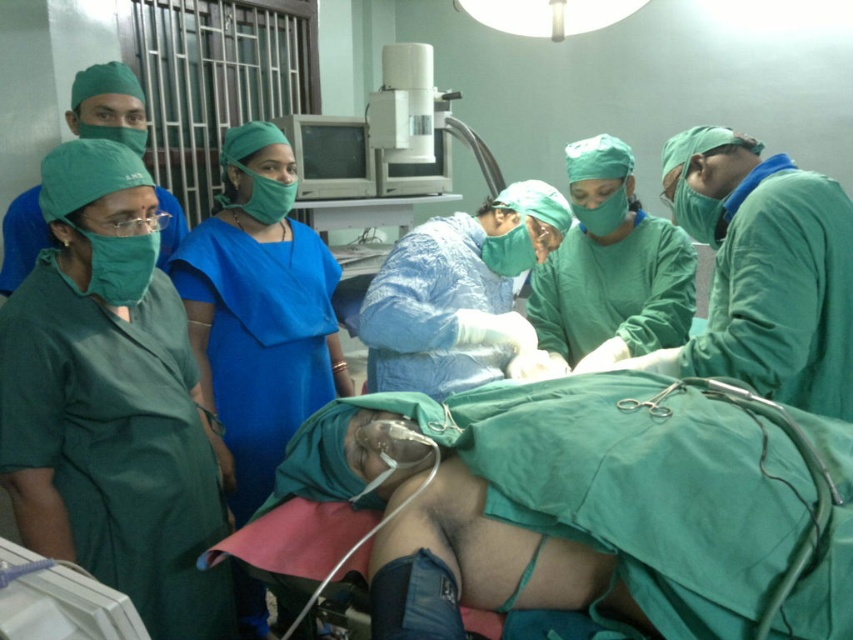
Question: Which of the following is the farthest from the observer?

Choices:
 (A) white plastic tube at lower left
 (B) green fabric oxygen mask at center
 (C) blue fabric dress at center
 (D) green smooth surgical gown at center

Answer: (C)

Question: Among these points, which one is nearest to the camera?

Choices:
 (A) (836, 433)
 (B) (100, 588)
 (C) (822, 410)
 (D) (289, 243)

Answer: (B)

Question: Can you confirm if blue fabric dress at center is thinner than white plastic tube at lower left?

Choices:
 (A) no
 (B) yes

Answer: (A)

Question: Can you confirm if green fabric oxygen mask at center is bigger than blue fabric dress at center?

Choices:
 (A) no
 (B) yes

Answer: (A)

Question: Among these objects, which one is farthest from the camera?

Choices:
 (A) blue fabric dress at center
 (B) green fabric oxygen mask at center
 (C) white plastic tube at lower left

Answer: (A)

Question: Does blue fabric dress at center appear on the right side of green smooth surgical gown at center?

Choices:
 (A) no
 (B) yes

Answer: (A)